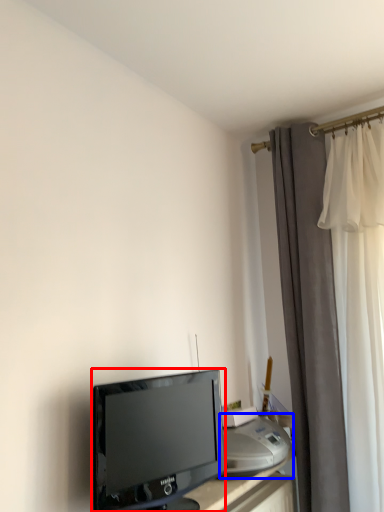
Question: Which of the following is the closest to the observer, television (highlighted by a red box) or printer (highlighted by a blue box)?

Choices:
 (A) television
 (B) printer

Answer: (A)